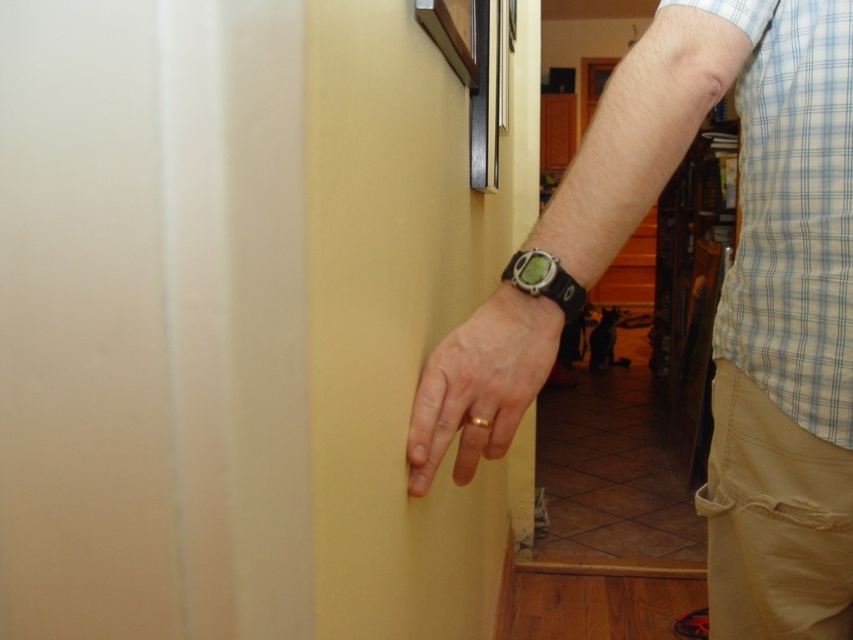
Question: Does matte black watch at upper right appear on the right side of khaki cotton pants at lower right?

Choices:
 (A) yes
 (B) no

Answer: (B)

Question: Is matte black watch at upper right positioned at the back of khaki cotton pants at lower right?

Choices:
 (A) no
 (B) yes

Answer: (A)

Question: Among these objects, which one is nearest to the camera?

Choices:
 (A) matte black watch at upper right
 (B) yellow matte door at center

Answer: (B)

Question: Which point appears closest to the camera in this image?

Choices:
 (A) (776, 509)
 (B) (451, 337)

Answer: (B)

Question: Which of the following is the closest to the observer?

Choices:
 (A) yellow matte door at center
 (B) khaki cotton pants at lower right
 (C) gold metallic ring at center

Answer: (A)

Question: Is matte black watch at upper right positioned before khaki cotton pants at lower right?

Choices:
 (A) yes
 (B) no

Answer: (A)